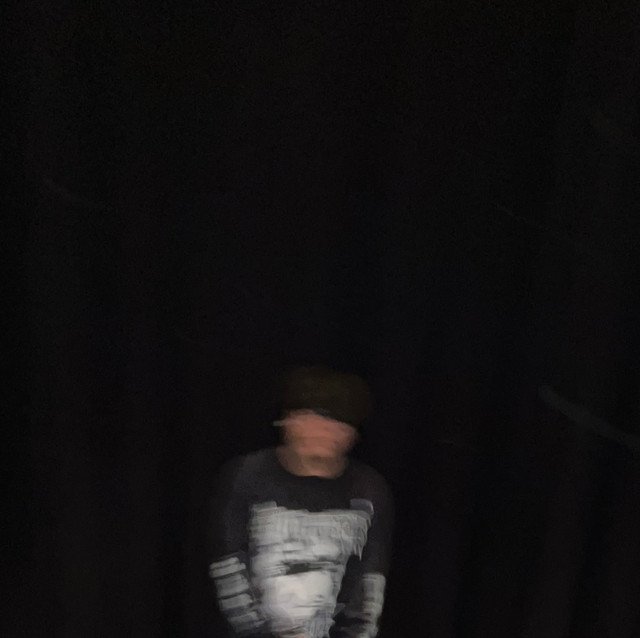
Where is `chest`? The height and width of the screenshot is (638, 640). chest is located at coordinates (296, 515).